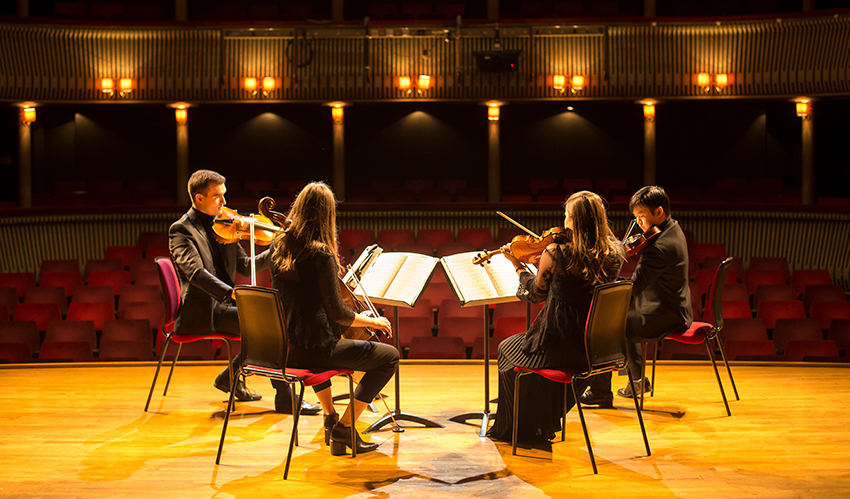
Locate an element on the screen. This screenshot has width=850, height=499. music stand is located at coordinates (404, 396), (485, 363).